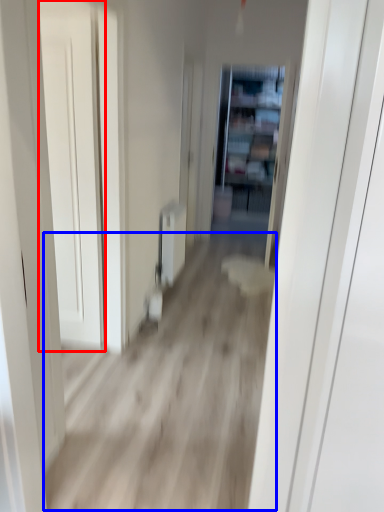
Question: Which of the following is the farthest to the observer, door (highlighted by a red box) or corridor (highlighted by a blue box)?

Choices:
 (A) door
 (B) corridor

Answer: (A)